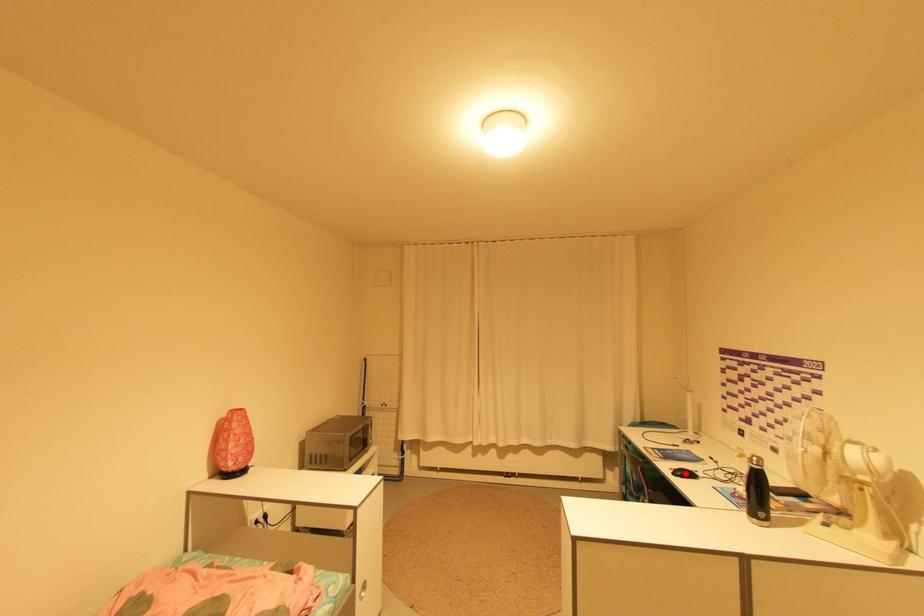
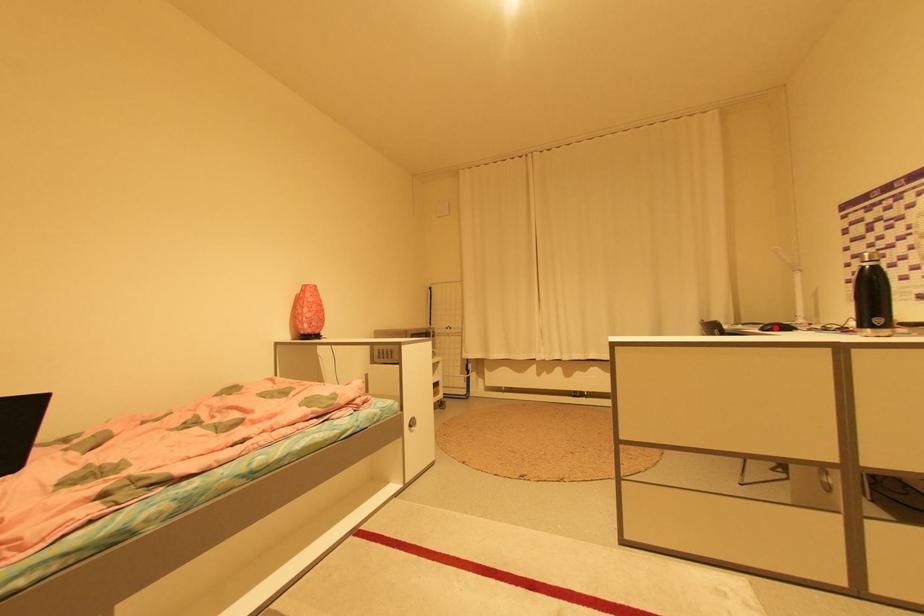
I am providing you with two images of the same scene from different viewpoints. A red point is marked on the first image and another point is marked on the second image. Are the points marked in image1 and image2 representing the same 3D position?

Yes